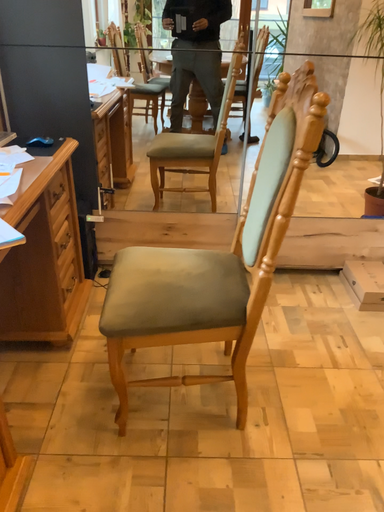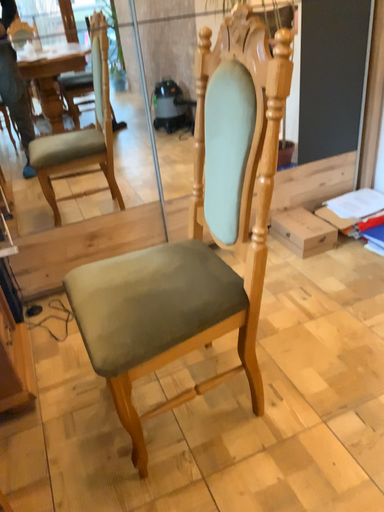
Question: How did the camera likely rotate when shooting the video?

Choices:
 (A) rotated left
 (B) rotated right

Answer: (B)